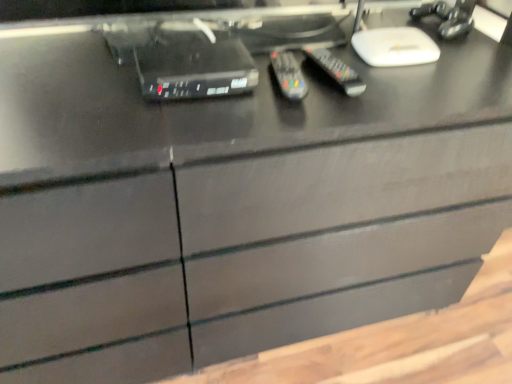
Question: Is black plastic remote at center, placed as the 1th control when sorted from left to right, looking in the opposite direction of black plastic remote at center, the second control when ordered from left to right?

Choices:
 (A) yes
 (B) no

Answer: (B)

Question: Considering the relative sizes of black plastic remote at center, placed as the 1th control when sorted from left to right, and black plastic remote at center, acting as the first control starting from the right, in the image provided, is black plastic remote at center, placed as the 1th control when sorted from left to right, thinner than black plastic remote at center, acting as the first control starting from the right,?

Choices:
 (A) no
 (B) yes

Answer: (B)

Question: Can you confirm if black plastic remote at center, placed as the 1th control when sorted from left to right, is taller than black plastic remote at center, the second control when ordered from left to right?

Choices:
 (A) yes
 (B) no

Answer: (B)

Question: Is black plastic remote at center, acting as the first control starting from the right, a part of black plastic remote at center, placed as the second control when sorted from right to left?

Choices:
 (A) no
 (B) yes

Answer: (A)

Question: From the image's perspective, is black plastic remote at center, placed as the 1th control when sorted from left to right, located beneath black plastic remote at center, acting as the first control starting from the right?

Choices:
 (A) yes
 (B) no

Answer: (A)

Question: Is black plastic remote at center, placed as the second control when sorted from right to left, smaller than black plastic remote at center, acting as the first control starting from the right?

Choices:
 (A) yes
 (B) no

Answer: (A)

Question: Is black plastic remote at center, the second control when ordered from left to right, far from black plastic device at upper center?

Choices:
 (A) no
 (B) yes

Answer: (A)

Question: Is black plastic remote at center, acting as the first control starting from the right, aimed at black plastic device at upper center?

Choices:
 (A) no
 (B) yes

Answer: (A)

Question: Does black plastic remote at center, the second control when ordered from left to right, lie in front of black plastic device at upper center?

Choices:
 (A) yes
 (B) no

Answer: (B)

Question: From a real-world perspective, is black plastic remote at center, the second control when ordered from left to right, beneath black plastic device at upper center?

Choices:
 (A) yes
 (B) no

Answer: (A)

Question: Does black plastic remote at center, acting as the first control starting from the right, lie behind black plastic device at upper center?

Choices:
 (A) yes
 (B) no

Answer: (A)

Question: Does black plastic remote at center, acting as the first control starting from the right, have a larger size compared to black plastic device at upper center?

Choices:
 (A) yes
 (B) no

Answer: (B)

Question: Considering the relative sizes of black plastic remote at center, the second control when ordered from left to right, and black plastic remote at center, placed as the 1th control when sorted from left to right, in the image provided, is black plastic remote at center, the second control when ordered from left to right, thinner than black plastic remote at center, placed as the 1th control when sorted from left to right,?

Choices:
 (A) yes
 (B) no

Answer: (B)